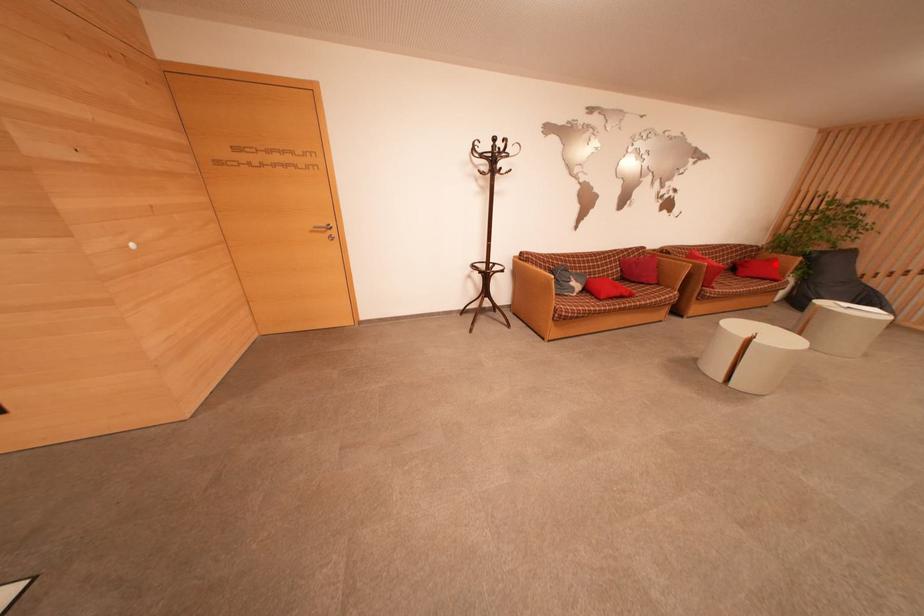
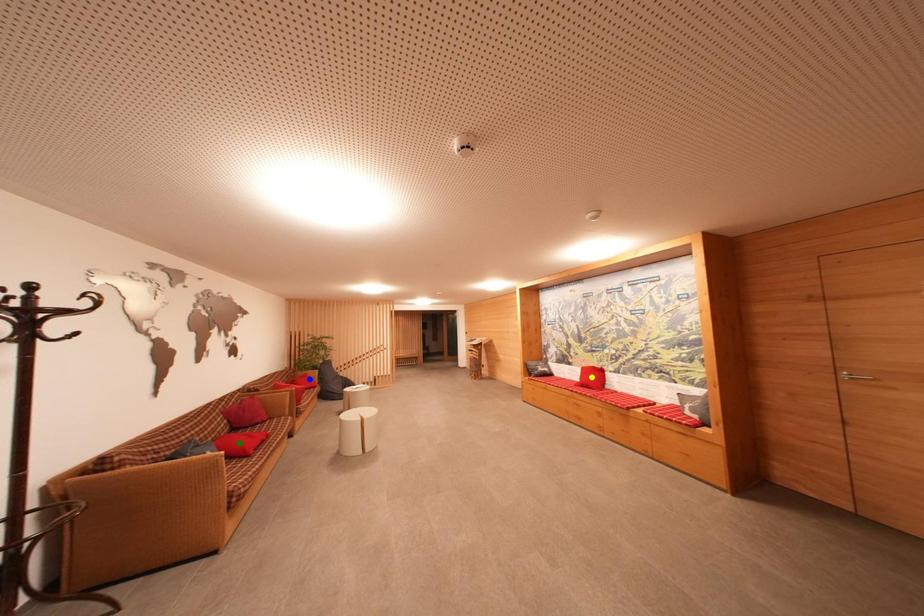
Question: I am providing you with two images of the same scene from different viewpoints. A red point is marked on the first image. You are given multiple points on the second image. Which point in image 2 is actually the same real-world point as the red point in image 1?

Choices:
 (A) yellow point
 (B) green point
 (C) blue point

Answer: (C)